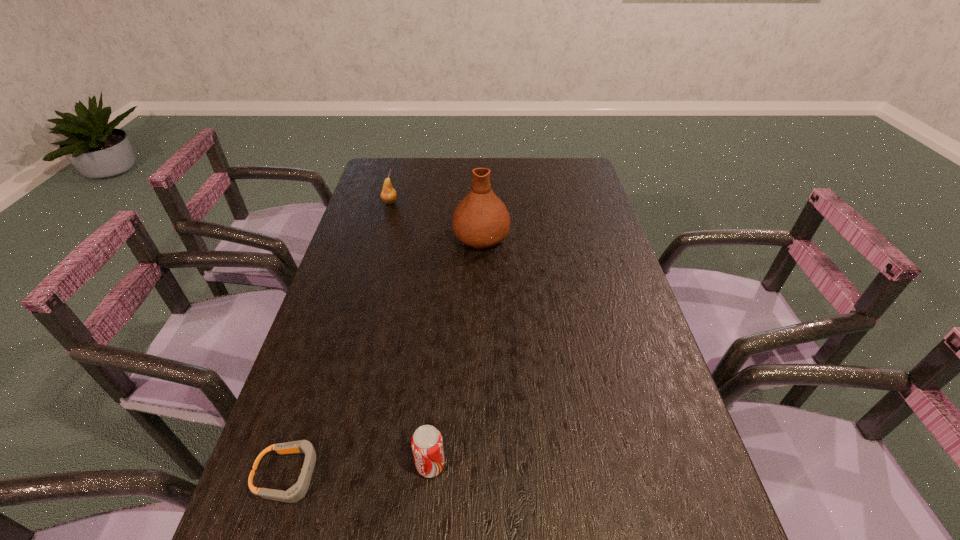
Locate an element on the screen. The width and height of the screenshot is (960, 540). pitcher is located at coordinates (481, 220).

At what (x,y) coordinates should I click in order to perform the action: click on the tallest object. Please return your answer as a coordinate pair (x, y). This screenshot has height=540, width=960. Looking at the image, I should click on (481, 220).

Locate an element on the screen. The height and width of the screenshot is (540, 960). pear is located at coordinates (388, 195).

The height and width of the screenshot is (540, 960). Find the location of `soda can`. soda can is located at coordinates (427, 445).

I want to click on goggles, so click(x=295, y=493).

Identify the location of blank space located 0.230m on the side of the pitcher with the handle. (481, 184).

The width and height of the screenshot is (960, 540). In order to click on vacant space situated 0.360m on the side of the pitcher with the handle in this screenshot , I will do `click(481, 167)`.

This screenshot has height=540, width=960. What are the coordinates of `vacant space positioned on the side of the pitcher with the handle` in the screenshot? It's located at (481, 176).

At what (x,y) coordinates should I click in order to perform the action: click on vacant space positioned 0.170m on the back of the farthest object. Please return your answer as a coordinate pair (x, y). The width and height of the screenshot is (960, 540). Looking at the image, I should click on (397, 174).

At what (x,y) coordinates should I click in order to perform the action: click on blank area located 0.100m on the logo side of the soda can. Please return your answer as a coordinate pair (x, y). The image size is (960, 540). Looking at the image, I should click on (496, 465).